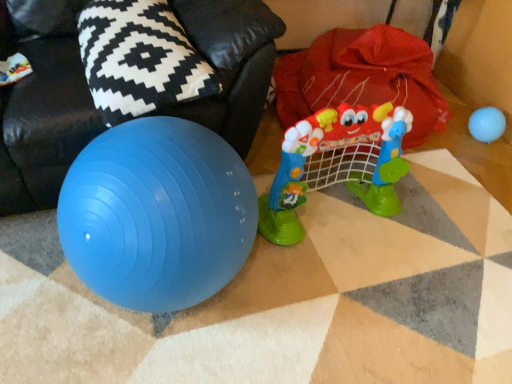
Question: Should I look upward or downward to see blue rubber ball at upper right, positioned as the second toy in left-to-right order?

Choices:
 (A) up
 (B) down

Answer: (A)

Question: Is blue rubber ball at upper right, positioned as the second toy in left-to-right order, facing towards red fabric bean bag at upper right?

Choices:
 (A) yes
 (B) no

Answer: (B)

Question: Is blue rubber ball at upper right, positioned as the 1th toy in right-to-left order, thinner than red fabric bean bag at upper right?

Choices:
 (A) no
 (B) yes

Answer: (B)

Question: Does blue rubber ball at upper right, positioned as the second toy in left-to-right order, have a smaller size compared to red fabric bean bag at upper right?

Choices:
 (A) no
 (B) yes

Answer: (B)

Question: From a real-world perspective, is blue rubber ball at upper right, the first toy positioned from the back, positioned under red fabric bean bag at upper right based on gravity?

Choices:
 (A) no
 (B) yes

Answer: (B)

Question: Is red fabric bean bag at upper right located within blue rubber ball at upper right, positioned as the second toy in left-to-right order?

Choices:
 (A) no
 (B) yes

Answer: (A)

Question: From a real-world perspective, does blue rubber ball at upper right, the first toy positioned from the back, stand above red fabric bean bag at upper right?

Choices:
 (A) yes
 (B) no

Answer: (B)

Question: Considering the relative positions of black and white patterned pillow at upper left and red fabric bean bag at upper right in the image provided, is black and white patterned pillow at upper left to the left of red fabric bean bag at upper right from the viewer's perspective?

Choices:
 (A) yes
 (B) no

Answer: (B)

Question: Does black and white patterned pillow at upper left have a lesser height compared to red fabric bean bag at upper right?

Choices:
 (A) yes
 (B) no

Answer: (A)

Question: Can you see black and white patterned pillow at upper left touching red fabric bean bag at upper right?

Choices:
 (A) no
 (B) yes

Answer: (A)

Question: Considering the relative sizes of black and white patterned pillow at upper left and red fabric bean bag at upper right in the image provided, is black and white patterned pillow at upper left taller than red fabric bean bag at upper right?

Choices:
 (A) no
 (B) yes

Answer: (A)

Question: Is black and white patterned pillow at upper left oriented towards red fabric bean bag at upper right?

Choices:
 (A) yes
 (B) no

Answer: (A)

Question: Is red fabric bean bag at upper right at the back of black and white patterned pillow at upper left?

Choices:
 (A) yes
 (B) no

Answer: (A)

Question: Is plastic toy at center, the 2th toy viewed from the right, closer to the viewer compared to black and white patterned pillow at upper left?

Choices:
 (A) no
 (B) yes

Answer: (A)